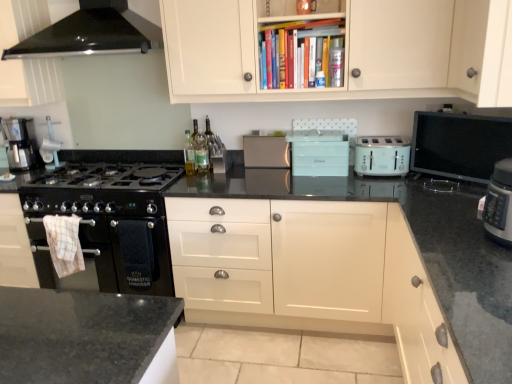
Question: Relative to mint green plastic toaster at center, which is the second appliance in right-to-left order, is satin silver toaster at center, placed as the first appliance when sorted from left to right, in front or behind?

Choices:
 (A) front
 (B) behind

Answer: (B)

Question: Is point click(247, 150) positioned closer to the camera than point click(291, 150)?

Choices:
 (A) closer
 (B) farther

Answer: (B)

Question: Considering the real-world distances, which object is closest to the translucent glass bottle at center, which appears as the 1th bottle when ordered from the bottom?

Choices:
 (A) mint green plastic toaster at right
 (B) flat screen tv at right, the third appliance from the left
 (C) black granite countertop at center
 (D) black glass range hood at upper left
 (E) translucent glass bottle at center, which ranks as the second bottle in top-to-bottom order

Answer: (E)

Question: Estimate the real-world distances between objects in this image. Which object is farther from the white checkered towel at left?

Choices:
 (A) flat screen tv at right, the third appliance from the left
 (B) translucent glass bottle at center, arranged as the second bottle when viewed from the left
 (C) translucent plastic bottle at upper center, acting as the 1th bottle starting from the front
 (D) translucent glass bottle at center, which appears as the 1th bottle when ordered from the bottom
 (E) black glass range hood at upper left

Answer: (A)